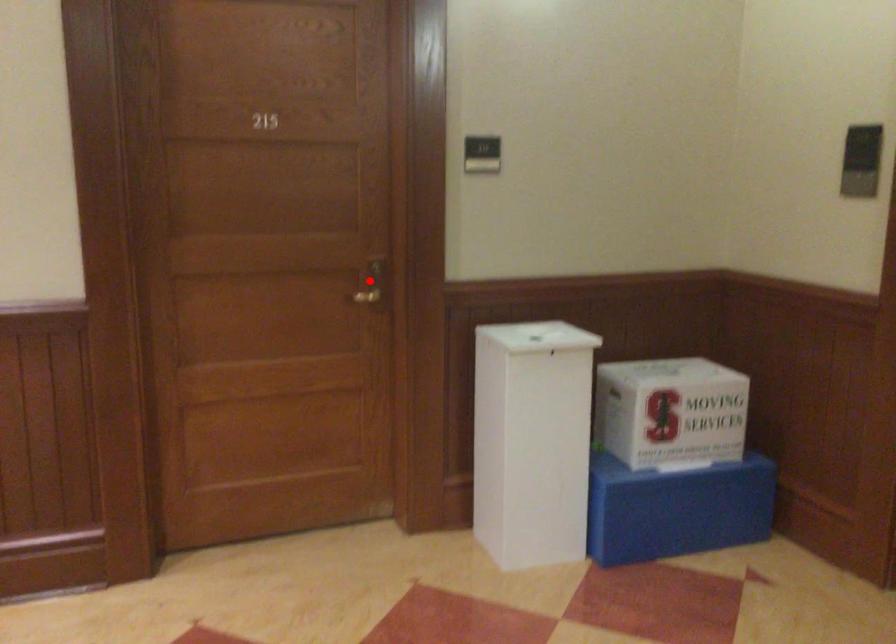
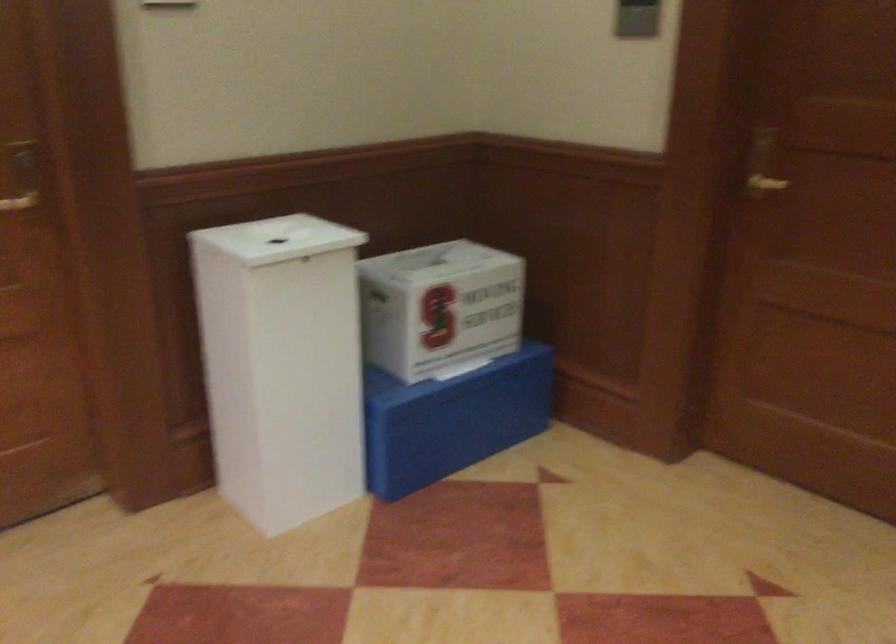
Question: I am providing you with two images of the same scene from different viewpoints. A red point is shown in image1. For the corresponding object point in image2, is it positioned nearer or farther from the camera?

Choices:
 (A) Nearer
 (B) Farther

Answer: (A)